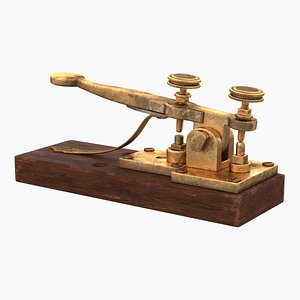
Where is `handle`? This screenshot has width=300, height=300. handle is located at coordinates (67, 78).